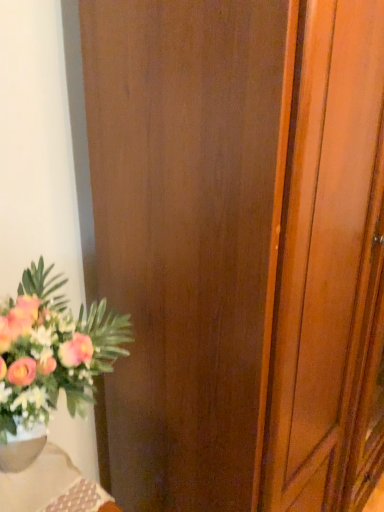
Describe the element at coordinates (49, 360) in the screenshot. I see `matte green plant at left` at that location.

From the picture: What is the approximate width of matte green plant at left?

It is 12.78 inches.

The width and height of the screenshot is (384, 512). Find the location of `matte green plant at left`. matte green plant at left is located at coordinates (49, 360).

I want to click on matte green plant at left, so click(x=49, y=360).